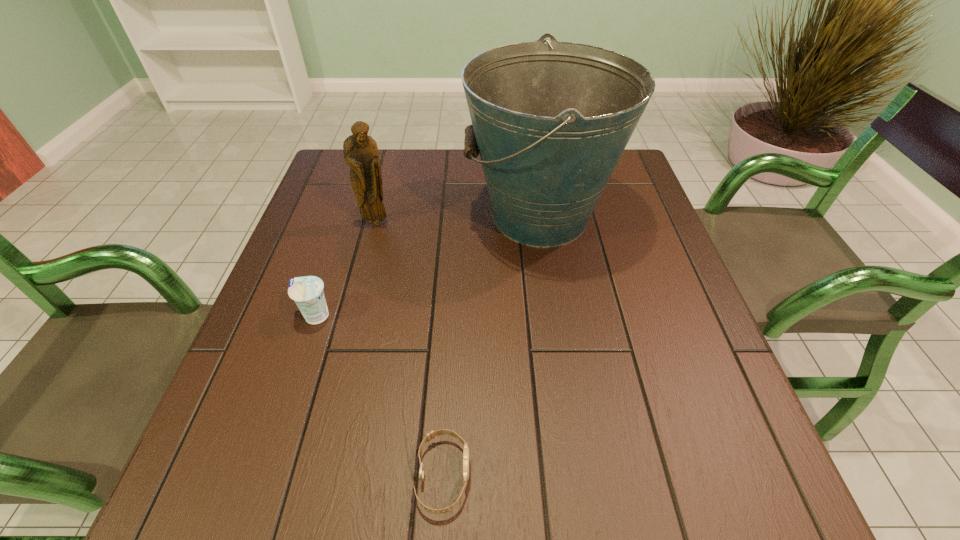
The image size is (960, 540). What are the coordinates of `vacant space at the right edge of the desktop` in the screenshot? It's located at (623, 289).

You are a GUI agent. You are given a task and a screenshot of the screen. Output one action in this format:
    pyautogui.click(x=<x>, y=<y>)
    Task: Click on the vacant space at the far left corner of the desktop
    
    Given the screenshot: What is the action you would take?
    pyautogui.click(x=328, y=169)

Where is `vacant region at the far right corner of the desktop`? vacant region at the far right corner of the desktop is located at coordinates (632, 171).

Where is `vacant space that is in between the bucket and the nearest object`? vacant space that is in between the bucket and the nearest object is located at coordinates (492, 346).

At what (x,y) coordinates should I click in order to perform the action: click on free space between the second tallest object and the nearest object. Please return your answer as a coordinate pair (x, y). Looking at the image, I should click on (410, 349).

Identify the location of vacant space that is in between the bucket and the nearest object. (492, 346).

Locate an element on the screen. The width and height of the screenshot is (960, 540). vacant area that lies between the second tallest object and the shortest object is located at coordinates (410, 349).

The width and height of the screenshot is (960, 540). Find the location of `empty location between the tallest object and the watch`. empty location between the tallest object and the watch is located at coordinates (492, 346).

Locate an element on the screen. This screenshot has height=540, width=960. free spot between the yogurt and the nearest object is located at coordinates (379, 396).

Find the location of a particular element. The width and height of the screenshot is (960, 540). free space between the nearest object and the figurine is located at coordinates (410, 349).